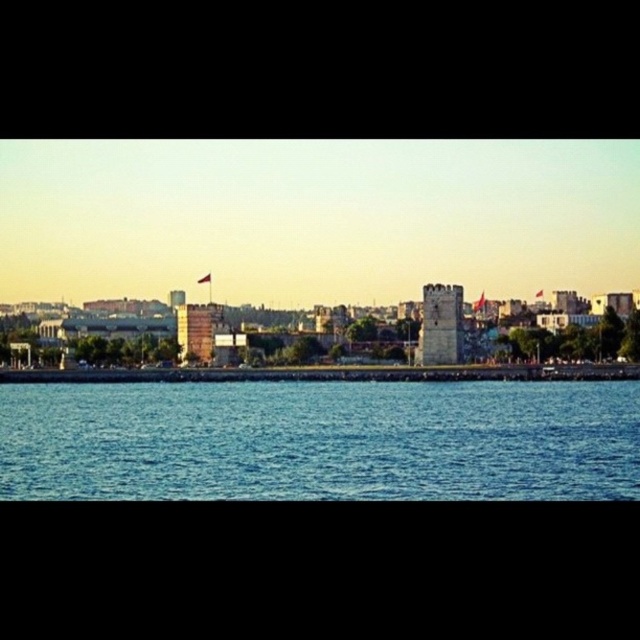
You are a city planner reviewing this waterfront area. You need to decide which of the two towers, the stone tower at center or the brick tower at center, requires more space for maintenance equipment. Which tower should you prioritize?

The stone tower at center is larger in size than the brick tower at center, so it requires more space for maintenance equipment and should be prioritized.

You are a photographer planning to take a sunset shot from the stone tower at center. You want to ensure the blue liquid water at lower center is fully visible in the frame. Given the height of the tower, will the water be entirely visible without obstruction?

The blue liquid water at lower center is taller than the stone tower at center, so the water will be entirely visible without obstruction from the tower.

You are a photographer standing at the waterfront. You want to take a photo that includes both the blue liquid water at lower center and the brick tower at center. Which object will appear closer to the camera in the photo?

The blue liquid water at lower center will appear closer to the camera because it is positioned in front of the brick tower at center.